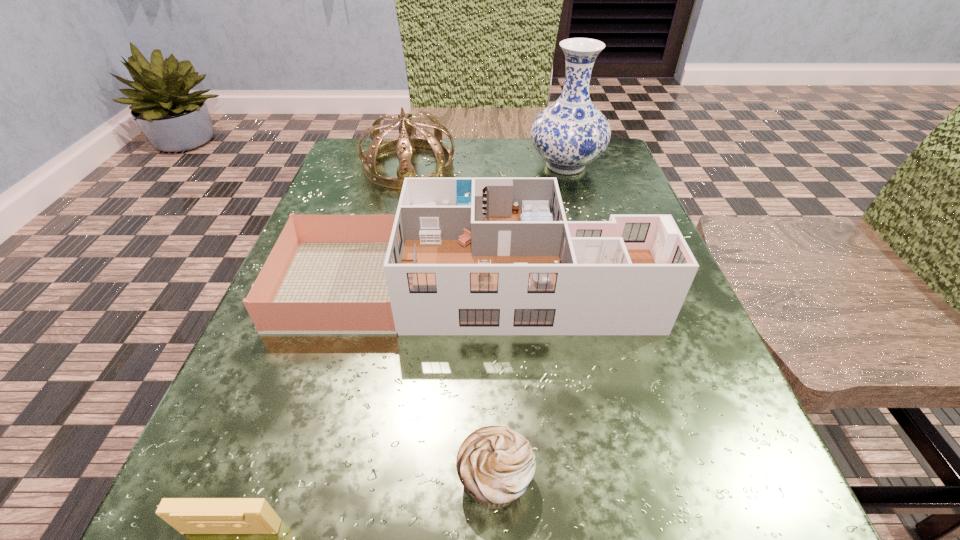
This screenshot has width=960, height=540. Find the location of `muffin at the near edge`. muffin at the near edge is located at coordinates (496, 465).

You are a GUI agent. You are given a task and a screenshot of the screen. Output one action in this format:
    pyautogui.click(x=<x>, y=<y>)
    Task: Click on the videotape located in the near edge section of the desktop
    Image resolution: width=960 pixels, height=540 pixels.
    Given the screenshot: What is the action you would take?
    [187, 515]

This screenshot has height=540, width=960. In order to click on tiara that is at the left edge in this screenshot , I will do `click(407, 139)`.

This screenshot has height=540, width=960. I want to click on dollhouse at the left edge, so click(x=466, y=256).

Identify the location of videotape at the left edge. (187, 515).

This screenshot has width=960, height=540. Identify the location of vase located in the right edge section of the desktop. (570, 133).

You are a GUI agent. You are given a task and a screenshot of the screen. Output one action in this format:
    pyautogui.click(x=<x>, y=<y>)
    Task: Click on the dollhouse situated at the right edge
    Image resolution: width=960 pixels, height=540 pixels.
    Given the screenshot: What is the action you would take?
    pyautogui.click(x=466, y=256)

In order to click on object positioned at the far left corner in this screenshot , I will do `click(407, 139)`.

Where is `object located at the near left corner`? This screenshot has height=540, width=960. object located at the near left corner is located at coordinates (187, 515).

At what (x,y) coordinates should I click in order to perform the action: click on object present at the far right corner. Please return your answer as a coordinate pair (x, y). The image size is (960, 540). Looking at the image, I should click on (570, 133).